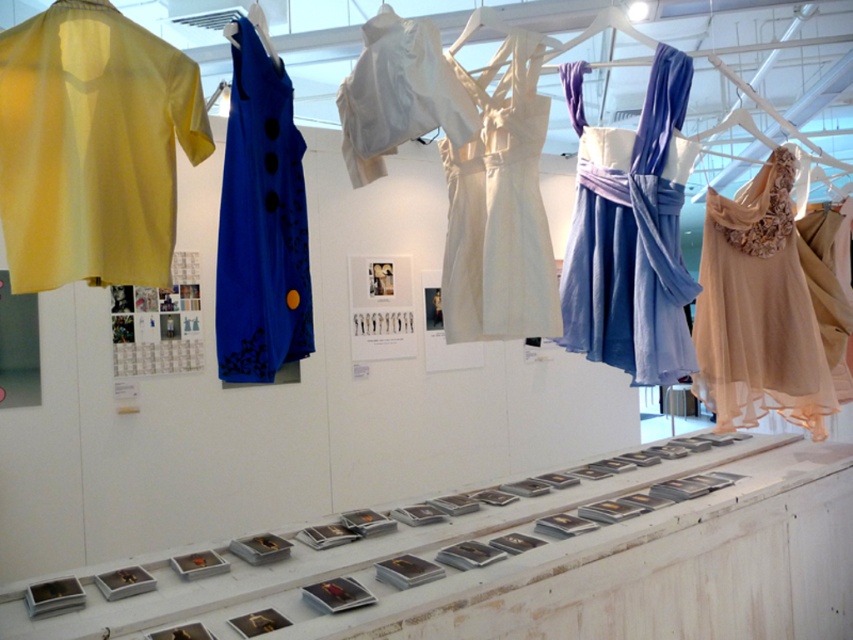
Question: From the image, what is the correct spatial relationship of ivory satin dress at center in relation to white satin blouse at center?

Choices:
 (A) above
 (B) below

Answer: (B)

Question: Which object is the closest to the satin blue dress at center?

Choices:
 (A) beige chiffon dress at right
 (B) blue satin dress at center

Answer: (A)

Question: Considering the relative positions of ivory satin dress at center and satin blue dress at center in the image provided, where is ivory satin dress at center located with respect to satin blue dress at center?

Choices:
 (A) below
 (B) above

Answer: (B)

Question: Considering the real-world distances, which object is closest to the satin blue dress at center?

Choices:
 (A) matte yellow shirt at upper left
 (B) white satin blouse at center
 (C) ivory satin dress at center

Answer: (C)

Question: Which object appears closest to the camera in this image?

Choices:
 (A) blue satin dress at center
 (B) matte yellow shirt at upper left

Answer: (B)

Question: Can you confirm if matte yellow shirt at upper left is thinner than satin blue dress at center?

Choices:
 (A) no
 (B) yes

Answer: (A)